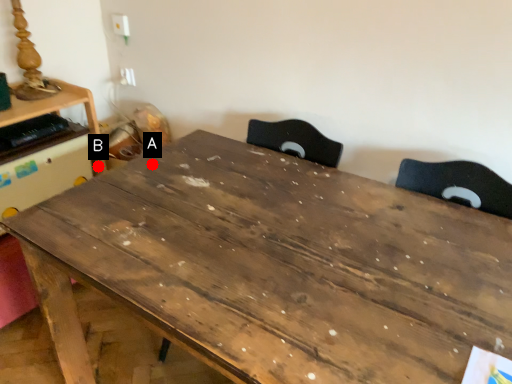
Question: Two points are circled on the image, labeled by A and B beside each circle. Which of the following is the closest to the observer?

Choices:
 (A) A is closer
 (B) B is closer

Answer: (A)